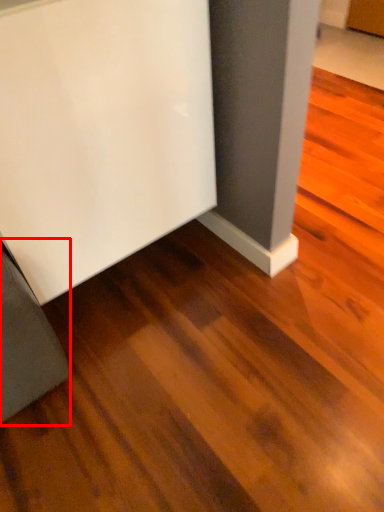
Question: From the image's perspective, where is furniture (annotated by the red box) located in relation to furniture in the image?

Choices:
 (A) below
 (B) above

Answer: (A)